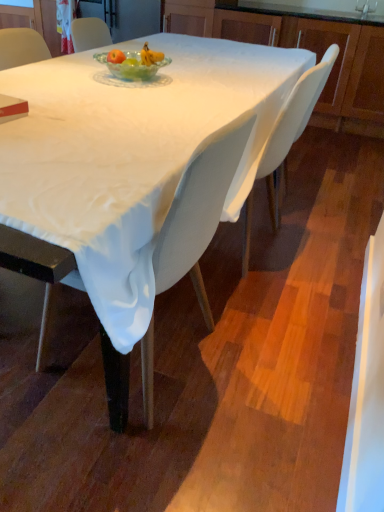
Identify the location of free point to the right of white plastic chair at center, which is the first chair in right-to-left order. (326, 211).